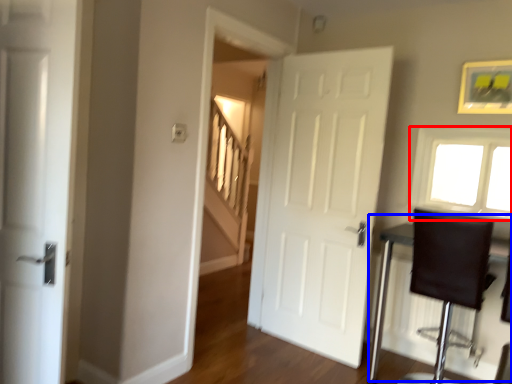
Question: Which object appears closest to the camera in this image, window (highlighted by a red box) or table (highlighted by a blue box)?

Choices:
 (A) window
 (B) table

Answer: (B)